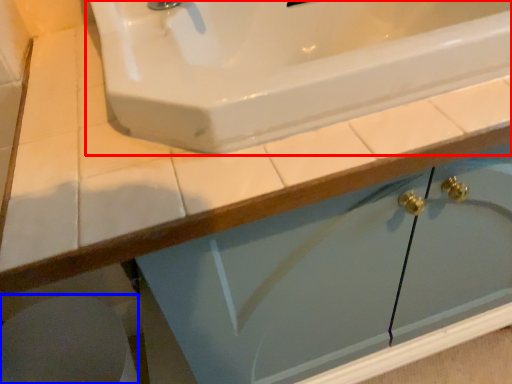
Question: Which of the following is the closest to the observer, sink (highlighted by a red box) or porcelain (highlighted by a blue box)?

Choices:
 (A) sink
 (B) porcelain

Answer: (A)